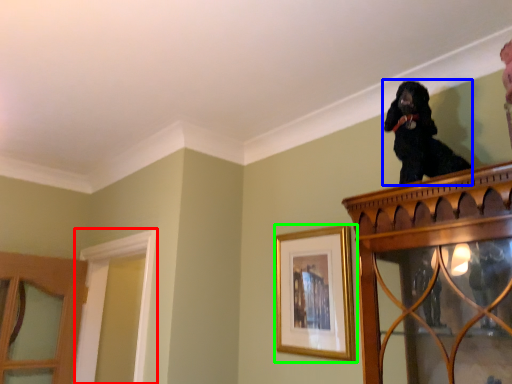
Question: Which object is the closest to the window frame (highlighted by a red box)? Choose among these: dog (highlighted by a blue box) or picture frame (highlighted by a green box).

Choices:
 (A) dog
 (B) picture frame

Answer: (B)